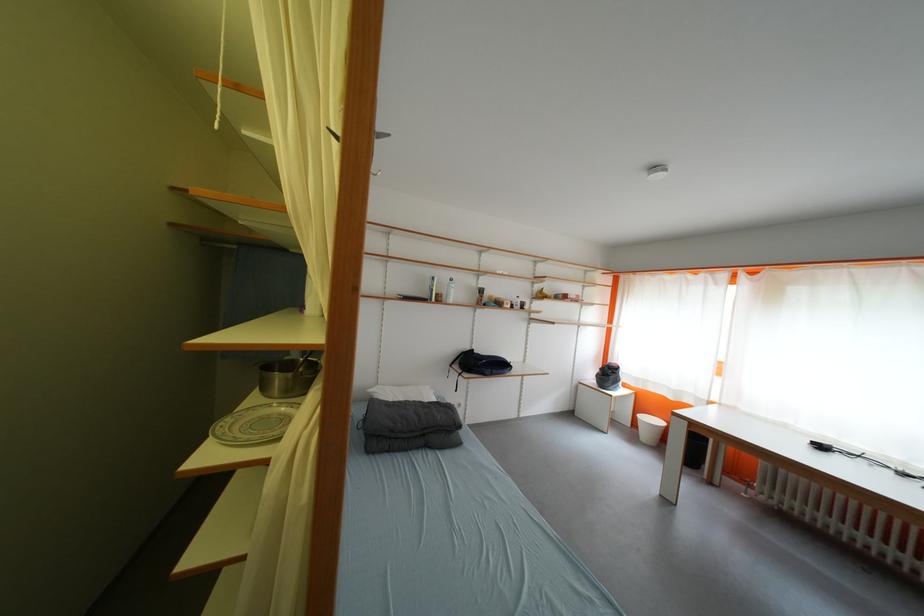
I want to click on patterned plate, so click(253, 424).